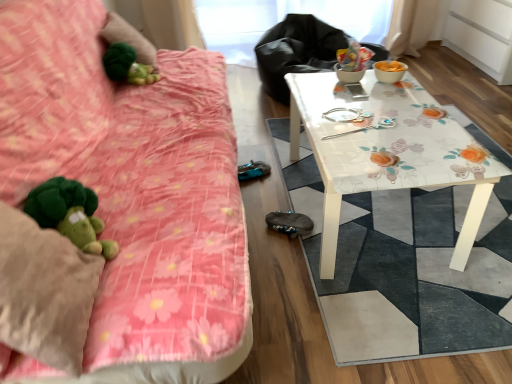
Describe the element at coordinates (70, 214) in the screenshot. I see `green plush toy at left, the 1th toy viewed from the front` at that location.

Locate an element on the screen. This screenshot has width=512, height=384. floral glass table at center is located at coordinates (387, 151).

At what (x,y) coordinates should I click in order to perform the action: click on metallic silver spoon at center. Please return your answer as a coordinate pair (x, y). The width and height of the screenshot is (512, 384). Looking at the image, I should click on [367, 128].

Where is `green plush toy at left, placed as the first toy when sorted from back to front`? Image resolution: width=512 pixels, height=384 pixels. green plush toy at left, placed as the first toy when sorted from back to front is located at coordinates (127, 66).

Does fluffy pink blanket at left have a greater width compared to green plush toy at left, the second toy in the front-to-back sequence?

Yes, fluffy pink blanket at left is wider than green plush toy at left, the second toy in the front-to-back sequence.

Is the surface of fluffy pink blanket at left in direct contact with green plush toy at left, the first toy positioned from the top?

fluffy pink blanket at left and green plush toy at left, the first toy positioned from the top, are clearly separated.

Is fluffy pink blanket at left to the left or to the right of green plush toy at left, the first toy positioned from the top, in the image?

Clearly, fluffy pink blanket at left is on the right of green plush toy at left, the first toy positioned from the top, in the image.

From a real-world perspective, between fluffy pink blanket at left and green plush toy at left, the first toy positioned from the top, who is vertically higher?

In real-world perspective, green plush toy at left, the first toy positioned from the top, is above.

Considering the sizes of objects green plush toy at left, the second toy when ordered from bottom to top, and green plush toy at left, the second toy in the top-to-bottom sequence, in the image provided, who is thinner, green plush toy at left, the second toy when ordered from bottom to top, or green plush toy at left, the second toy in the top-to-bottom sequence,?

Thinner between the two is green plush toy at left, the second toy in the top-to-bottom sequence.

Is green plush toy at left, arranged as the first toy when ordered from the bottom, at the back of green plush toy at left, placed as the first toy when sorted from back to front?

No, green plush toy at left, placed as the first toy when sorted from back to front,'s orientation is not away from green plush toy at left, arranged as the first toy when ordered from the bottom.

Considering the relative sizes of green plush toy at left, the first toy positioned from the top, and green plush toy at left, the second toy in the top-to-bottom sequence, in the image provided, is green plush toy at left, the first toy positioned from the top, bigger than green plush toy at left, the second toy in the top-to-bottom sequence,?

Actually, green plush toy at left, the first toy positioned from the top, might be smaller than green plush toy at left, the second toy in the top-to-bottom sequence.

Between green plush at upper left and green plush toy at left, placed as the first toy when sorted from back to front, which one has larger size?

green plush at upper left.

Looking at this image, can you tell me how much green plush at upper left and green plush toy at left, placed as the first toy when sorted from back to front, differ in facing direction?

3.91e-05 degrees.

Is green plush at upper left oriented towards green plush toy at left, the second toy in the front-to-back sequence?

No, green plush at upper left does not turn towards green plush toy at left, the second toy in the front-to-back sequence.

Is fluffy pink blanket at left positioned with its back to metallic silver spoon at center?

Yes, metallic silver spoon at center is at the back of fluffy pink blanket at left.

Considering the sizes of objects fluffy pink blanket at left and metallic silver spoon at center in the image provided, who is wider, fluffy pink blanket at left or metallic silver spoon at center?

With larger width is fluffy pink blanket at left.

From a real-world perspective, is fluffy pink blanket at left positioned over metallic silver spoon at center based on gravity?

Incorrect, from a real-world perspective, fluffy pink blanket at left is lower than metallic silver spoon at center.

At what (x,y) coordinates should I click in order to perform the action: click on sit above the floral glass table at center (from the image's perspective). Please return your answer as a coordinate pair (x, y). Looking at the image, I should click on (296, 51).

Is point (277, 57) in front of point (329, 267)?

No.

Is floral-patterned table at right oriented towards floral glass table at center?

No, floral-patterned table at right does not turn towards floral glass table at center.

Is green plush toy at left, placed as the first toy when sorted from back to front, oriented away from green plush at upper left?

No, green plush at upper left is not at the back of green plush toy at left, placed as the first toy when sorted from back to front.

Considering the positions of objects green plush toy at left, the first toy positioned from the top, and green plush at upper left in the image provided, who is more to the left, green plush toy at left, the first toy positioned from the top, or green plush at upper left?

green plush at upper left is more to the left.

Is point (152, 67) closer or farther from the camera than point (112, 35)?

Point (152, 67).

Looking at their sizes, would you say green plush toy at left, placed as the first toy when sorted from back to front, is wider or thinner than green plush at upper left?

In the image, green plush toy at left, placed as the first toy when sorted from back to front, appears to be more narrow than green plush at upper left.

Is green plush toy at left, which ranks as the 2th toy in back-to-front order, looking in the opposite direction of metallic silver spoon at center?

No, metallic silver spoon at center is not at the back of green plush toy at left, which ranks as the 2th toy in back-to-front order.

Considering the relative sizes of green plush toy at left, the second toy in the top-to-bottom sequence, and metallic silver spoon at center in the image provided, is green plush toy at left, the second toy in the top-to-bottom sequence, smaller than metallic silver spoon at center?

Incorrect, green plush toy at left, the second toy in the top-to-bottom sequence, is not smaller in size than metallic silver spoon at center.

Is green plush toy at left, the second toy in the top-to-bottom sequence, wider than metallic silver spoon at center?

Yes.

Is green plush toy at left, the second toy in the top-to-bottom sequence, at the left side of metallic silver spoon at center?

Correct, you'll find green plush toy at left, the second toy in the top-to-bottom sequence, to the left of metallic silver spoon at center.

You are a GUI agent. You are given a task and a screenshot of the screen. Output one action in this format:
    pyautogui.click(x=<x>, y=<y>)
    Task: Click on the 2nd toy behind the fluffy pink blanket at left, starting your count from the anchor
    
    Given the screenshot: What is the action you would take?
    pyautogui.click(x=127, y=66)

At what (x,y) coordinates should I click in order to perform the action: click on toy that appears in front of the green plush toy at left, placed as the first toy when sorted from back to front. Please return your answer as a coordinate pair (x, y). This screenshot has height=384, width=512. Looking at the image, I should click on (70, 214).

Based on their spatial positions, is green plush at upper left or green plush toy at left, the 1th toy viewed from the front, closer to green plush toy at left, placed as the first toy when sorted from back to front?

green plush at upper left is positioned closer to the anchor green plush toy at left, placed as the first toy when sorted from back to front.

In the scene shown: From the image, which object appears to be nearer to fluffy pink blanket at left, green plush at upper left or floral glass table at center?

floral glass table at center.

Looking at the image, which one is located closer to green plush at upper left, floral glass table at center or green plush toy at left, which ranks as the 2th toy in back-to-front order?

Among the two, floral glass table at center is located nearer to green plush at upper left.

Looking at the image, which one is located further to floral-patterned table at right, floral glass table at center or metallic silver spoon at center?

metallic silver spoon at center is positioned further to the anchor floral-patterned table at right.

Estimate the real-world distances between objects in this image. Which object is further from floral-patterned table at right, green plush toy at left, placed as the first toy when sorted from back to front, or green plush at upper left?

green plush toy at left, placed as the first toy when sorted from back to front, is positioned further to the anchor floral-patterned table at right.

Considering their positions, is floral glass table at center positioned further to metallic silver spoon at center than green plush toy at left, placed as the first toy when sorted from back to front?

green plush toy at left, placed as the first toy when sorted from back to front, is positioned further to the anchor metallic silver spoon at center.

Which object lies further to the anchor point fluffy pink blanket at left, floral glass table at center or green plush toy at left, placed as the first toy when sorted from back to front?

The object further to fluffy pink blanket at left is green plush toy at left, placed as the first toy when sorted from back to front.

From the image, which object appears to be farther from fluffy pink blanket at left, floral-patterned table at right or metallic silver spoon at center?

Based on the image, floral-patterned table at right appears to be further to fluffy pink blanket at left.

This screenshot has height=384, width=512. What are the coordinates of `twin located between fluffy pink blanket at left and green plush at upper left in the depth direction` in the screenshot? It's located at (367, 128).

Locate an element on the screen. The height and width of the screenshot is (384, 512). toy between green plush toy at left, the second toy in the front-to-back sequence, and metallic silver spoon at center is located at coordinates (70, 214).

Locate an element on the screen. twin between green plush toy at left, arranged as the first toy when ordered from the bottom, and floral glass table at center is located at coordinates click(x=367, y=128).

Find the location of a particular element. toy situated between green plush toy at left, the first toy positioned from the top, and floral glass table at center from left to right is located at coordinates (70, 214).